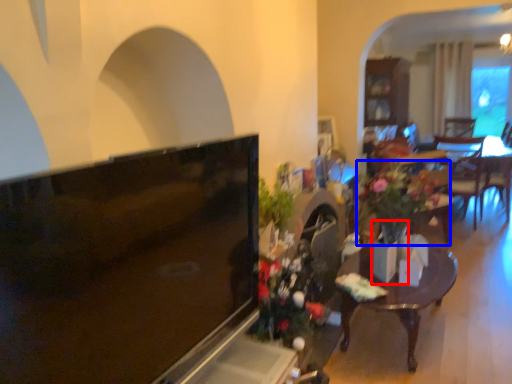
Question: Which object is further to the camera taking this photo, vase (highlighted by a red box) or houseplant (highlighted by a blue box)?

Choices:
 (A) vase
 (B) houseplant

Answer: (B)